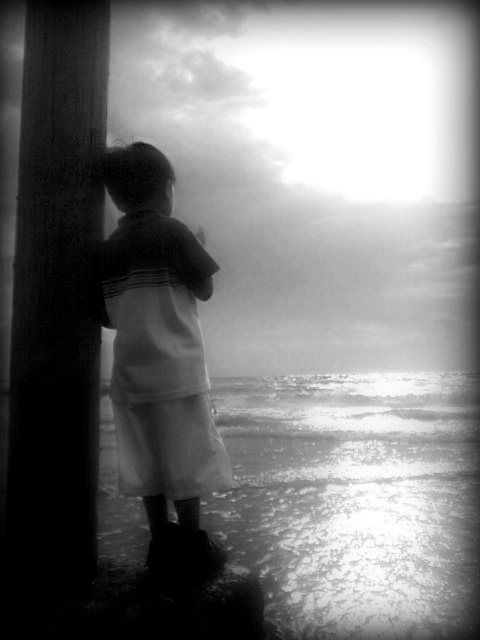
Which is behind, point (228, 497) or point (27, 24)?

The point (228, 497) is more distant.

Is reflective wet sand at lower center shorter than smooth wood post at left?

Yes, reflective wet sand at lower center is shorter than smooth wood post at left.

Is point (117, 556) positioned before point (19, 620)?

No.

Identify the location of reflective wet sand at lower center. The width and height of the screenshot is (480, 640). (354, 499).

Who is more distant from viewer, (91, 301) or (109, 324)?

Point (109, 324)

Is point (84, 349) closer to camera compared to point (178, 547)?

Yes, point (84, 349) is closer to viewer.

Locate an element on the screen. smooth wood post at left is located at coordinates (56, 310).

Which is above, reflective wet sand at lower center or white cotton shirt at left?

white cotton shirt at left

Does reflective wet sand at lower center have a smaller size compared to white cotton shirt at left?

Actually, reflective wet sand at lower center might be larger than white cotton shirt at left.

Where is `reflective wet sand at lower center`? reflective wet sand at lower center is located at coordinates (354, 499).

This screenshot has height=640, width=480. In order to click on reflective wet sand at lower center in this screenshot , I will do `click(354, 499)`.